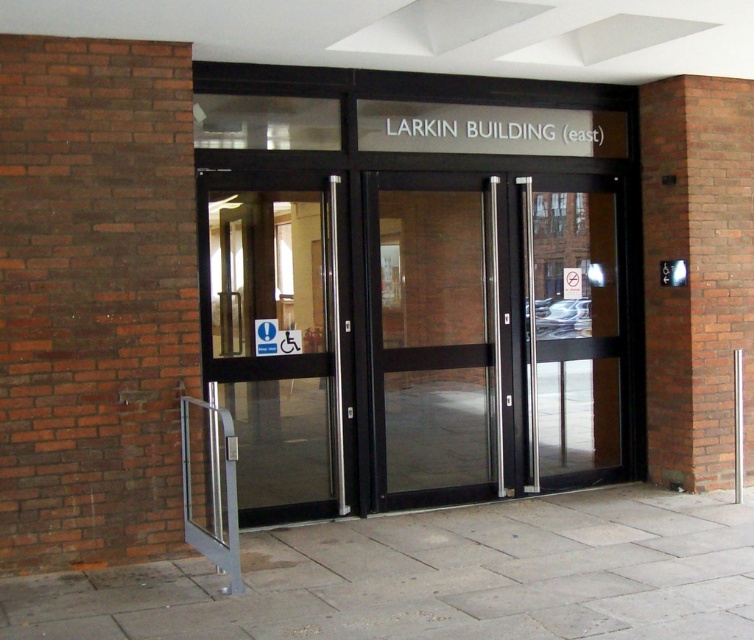
The height and width of the screenshot is (640, 754). What do you see at coordinates (412, 332) in the screenshot?
I see `transparent glass elevator at center` at bounding box center [412, 332].

Does transparent glass elevator at center appear on the right side of transparent glass door at center?

Incorrect, transparent glass elevator at center is not on the right side of transparent glass door at center.

Image resolution: width=754 pixels, height=640 pixels. Describe the element at coordinates (412, 332) in the screenshot. I see `transparent glass elevator at center` at that location.

Locate an element on the screen. Image resolution: width=754 pixels, height=640 pixels. transparent glass elevator at center is located at coordinates (412, 332).

The width and height of the screenshot is (754, 640). What do you see at coordinates (276, 339) in the screenshot? I see `transparent glass door at left` at bounding box center [276, 339].

Who is lower down, transparent glass door at left or transparent glass door at center?

transparent glass door at left is below.

Between point (307, 412) and point (405, 404), which one is positioned in front?

Point (307, 412) is more forward.

The height and width of the screenshot is (640, 754). In order to click on transparent glass door at left in this screenshot , I will do `click(276, 339)`.

Between transparent glass door at center and transparent glass door at right, which one appears on the left side from the viewer's perspective?

transparent glass door at center

Does point (449, 353) come in front of point (584, 396)?

Yes, it is in front of point (584, 396).

The image size is (754, 640). I want to click on transparent glass door at center, so click(434, 337).